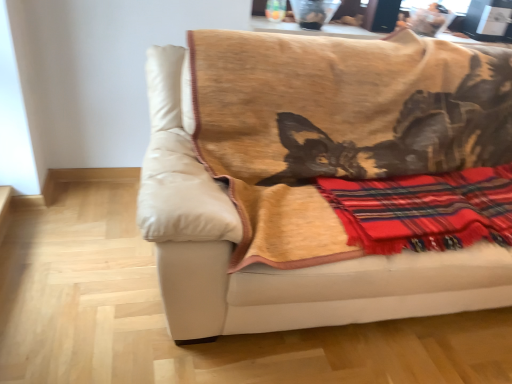
I want to click on beige leather couch at center, so click(x=313, y=171).

What is the approximate width of beige leather couch at center?

The width of beige leather couch at center is 1.03 meters.

Describe the element at coordinates (313, 171) in the screenshot. I see `beige leather couch at center` at that location.

This screenshot has width=512, height=384. I want to click on red plaid blanket at right, so click(424, 210).

The width and height of the screenshot is (512, 384). Describe the element at coordinates (424, 210) in the screenshot. I see `red plaid blanket at right` at that location.

The image size is (512, 384). Find the location of `beige leather couch at center`. beige leather couch at center is located at coordinates (313, 171).

Looking at this image, which is more to the left, beige leather couch at center or red plaid blanket at right?

Positioned to the left is beige leather couch at center.

Is beige leather couch at center in front of red plaid blanket at right?

Yes, beige leather couch at center is closer to the camera.

Is point (336, 108) farther from viewer compared to point (397, 241)?

Yes, it is.

From the image's perspective, would you say beige leather couch at center is shown under red plaid blanket at right?

No, from the image's perspective, beige leather couch at center is not below red plaid blanket at right.

From a real-world perspective, is beige leather couch at center located higher than red plaid blanket at right?

No.

Considering the sizes of beige leather couch at center and red plaid blanket at right in the image, is beige leather couch at center wider or thinner than red plaid blanket at right?

Clearly, beige leather couch at center has more width compared to red plaid blanket at right.

Can you confirm if beige leather couch at center is shorter than red plaid blanket at right?

In fact, beige leather couch at center may be taller than red plaid blanket at right.

Which of these two, beige leather couch at center or red plaid blanket at right, is smaller?

red plaid blanket at right.

Is beige leather couch at center completely or partially outside of red plaid blanket at right?

Absolutely, beige leather couch at center is external to red plaid blanket at right.

Is beige leather couch at center positioned far away from red plaid blanket at right?

No, there isn't a large distance between beige leather couch at center and red plaid blanket at right.

Based on the photo, is beige leather couch at center facing away from red plaid blanket at right?

Yes.

Measure the distance from beige leather couch at center to red plaid blanket at right.

beige leather couch at center and red plaid blanket at right are 27.04 centimeters apart from each other.

Locate an element on the screen. This screenshot has height=384, width=512. studio couch located on the left of red plaid blanket at right is located at coordinates (313, 171).

Considering the positions of objects red plaid blanket at right and beige leather couch at center in the image provided, who is more to the right, red plaid blanket at right or beige leather couch at center?

red plaid blanket at right is more to the right.

From the picture: Is the position of red plaid blanket at right less distant than that of beige leather couch at center?

No, red plaid blanket at right is further to the viewer.

Considering the positions of points (505, 222) and (250, 143), is point (505, 222) closer to camera compared to point (250, 143)?

Yes.

From the image's perspective, which object appears higher, red plaid blanket at right or beige leather couch at center?

beige leather couch at center is shown above in the image.

From a real-world perspective, is red plaid blanket at right above or below beige leather couch at center?

In terms of real-world spatial position, red plaid blanket at right is above beige leather couch at center.

In the scene shown: Considering the relative sizes of red plaid blanket at right and beige leather couch at center in the image provided, is red plaid blanket at right wider than beige leather couch at center?

Incorrect, the width of red plaid blanket at right does not surpass that of beige leather couch at center.

Can you confirm if red plaid blanket at right is taller than beige leather couch at center?

In fact, red plaid blanket at right may be shorter than beige leather couch at center.

Does red plaid blanket at right have a larger size compared to beige leather couch at center?

No.

Can beige leather couch at center be found inside red plaid blanket at right?

No, beige leather couch at center is not a part of red plaid blanket at right.

Is red plaid blanket at right positioned far away from beige leather couch at center?

They are positioned close to each other.

Is red plaid blanket at right oriented towards beige leather couch at center?

Yes, red plaid blanket at right is facing beige leather couch at center.

Consider the image. What's the angular difference between red plaid blanket at right and beige leather couch at center's facing directions?

0.492 degrees.

Consider the image. How much distance is there between red plaid blanket at right and beige leather couch at center?

The distance of red plaid blanket at right from beige leather couch at center is 10.65 inches.

The height and width of the screenshot is (384, 512). In the image, there is a red plaid blanket at right. Identify the location of studio couch below it (from a real-world perspective). (313, 171).

Where is `plaid positioned vertically above the beige leather couch at center (from a real-world perspective)`? The height and width of the screenshot is (384, 512). plaid positioned vertically above the beige leather couch at center (from a real-world perspective) is located at coordinates (424, 210).

At what (x,y) coordinates should I click in order to perform the action: click on studio couch that is in front of the red plaid blanket at right. Please return your answer as a coordinate pair (x, y). The width and height of the screenshot is (512, 384). Looking at the image, I should click on (313, 171).